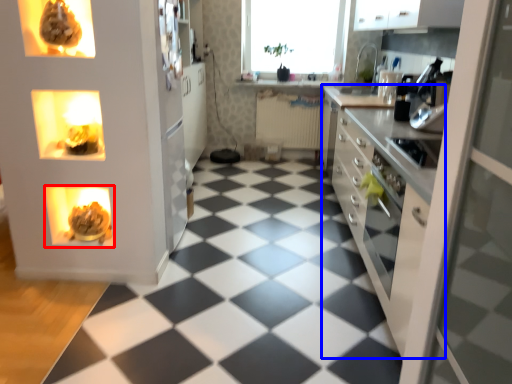
Question: Which object appears farthest to the camera in this image, appliance (highlighted by a red box) or countertop (highlighted by a blue box)?

Choices:
 (A) appliance
 (B) countertop

Answer: (A)